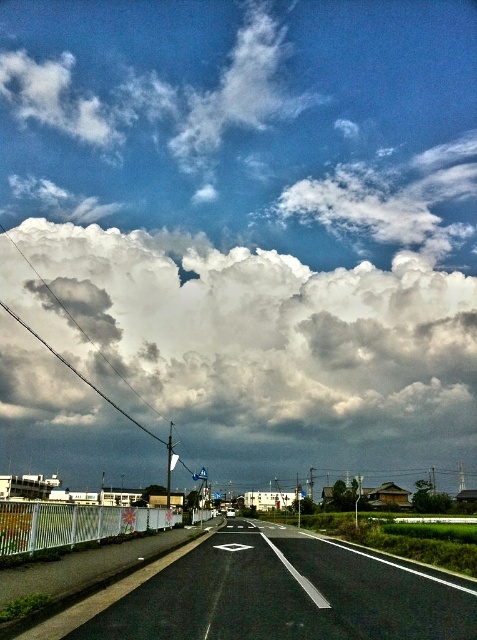
You are a drone operator planning to capture aerial footage of the white fluffy cloud at upper center and the black asphalt highway at center. Which object would require a wider camera frame to fully capture in the shot?

The white fluffy cloud at upper center requires a wider camera frame because its width is larger than the black asphalt highway at center.

You are a drone operator flying a drone over a rural area. Your drone is currently above the white fluffy cloud at upper center and the black asphalt highway at center. Which object is closer to the drone?

The white fluffy cloud at upper center is closer to the drone because the black asphalt highway at center is behind it.